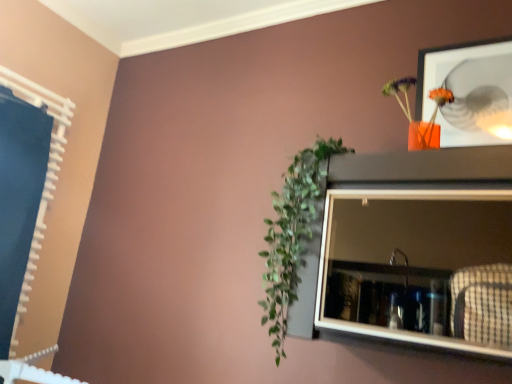
Question: From a real-world perspective, is green leafy plant at center-left positioned above or below matte gray medicine cabinet at upper right?

Choices:
 (A) below
 (B) above

Answer: (B)

Question: Considering the positions of green leafy plant at center-left and matte gray medicine cabinet at upper right in the image, is green leafy plant at center-left wider or thinner than matte gray medicine cabinet at upper right?

Choices:
 (A) wide
 (B) thin

Answer: (B)

Question: Based on their relative distances, which object is farther from the matte gray medicine cabinet at upper right?

Choices:
 (A) green leafy plant at center-left
 (B) orange matte vase at upper right

Answer: (B)

Question: Estimate the real-world distances between objects in this image. Which object is farther from the orange matte vase at upper right?

Choices:
 (A) green leafy plant at center-left
 (B) matte gray medicine cabinet at upper right

Answer: (A)